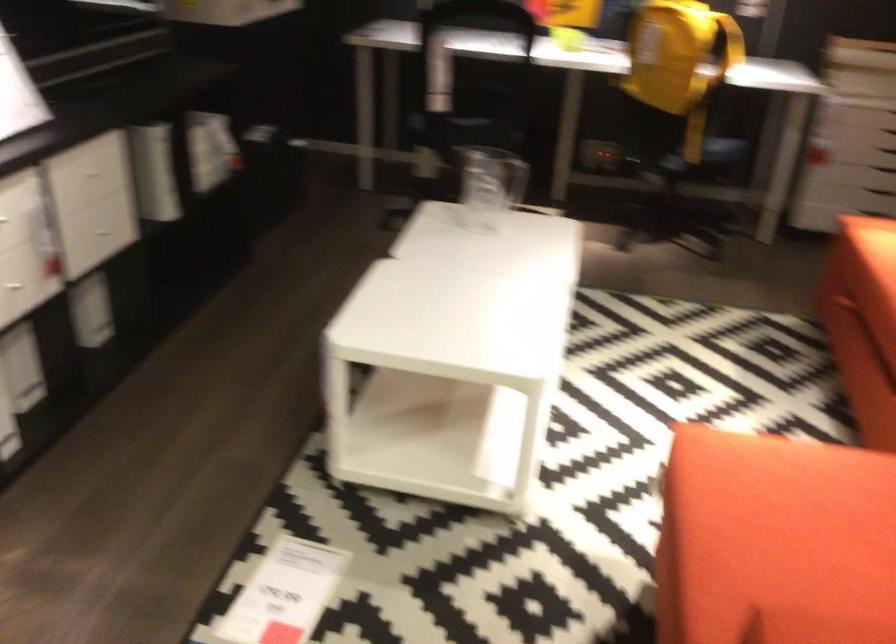
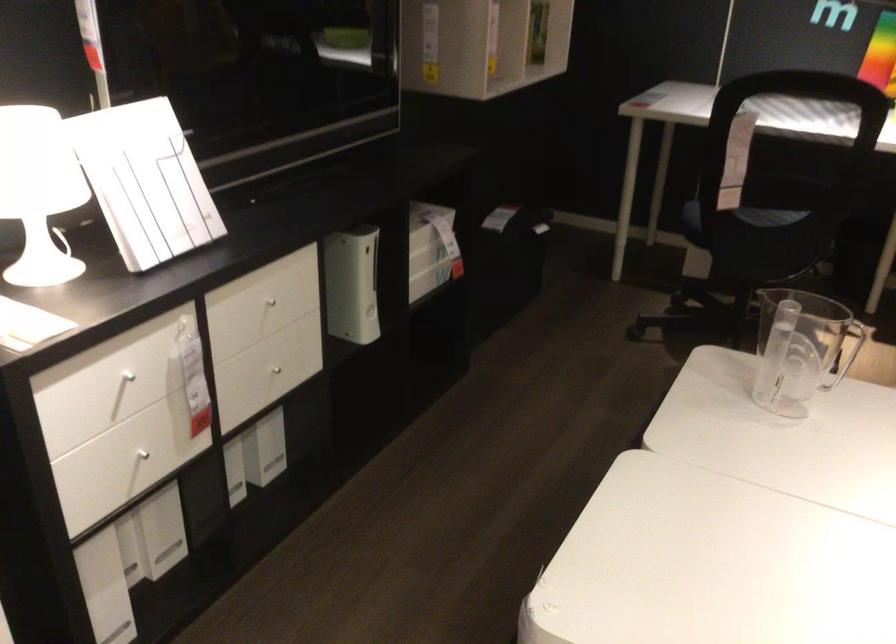
The point at [151,174] is marked in the first image. Where is the corresponding point in the second image?

(351, 285)